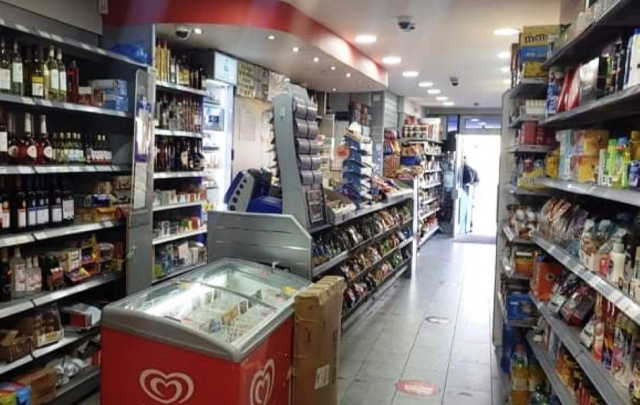
You are a GUI agent. You are given a task and a screenshot of the screen. Output one action in this format:
    pyautogui.click(x=<x>, y=<y>)
    Task: Click on the floor tiles
    Image resolution: width=640 pixels, height=405 pixels.
    Given the screenshot: What is the action you would take?
    pyautogui.click(x=402, y=336)